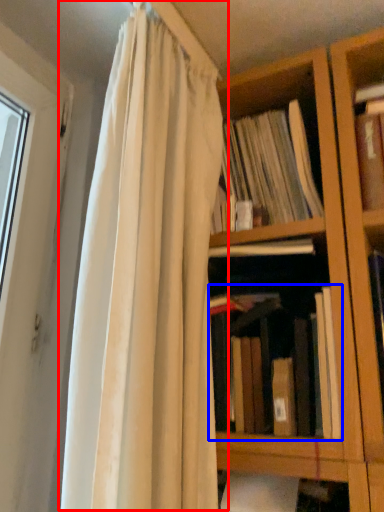
Question: Which object is further to the camera taking this photo, curtain (highlighted by a red box) or book (highlighted by a blue box)?

Choices:
 (A) curtain
 (B) book

Answer: (B)